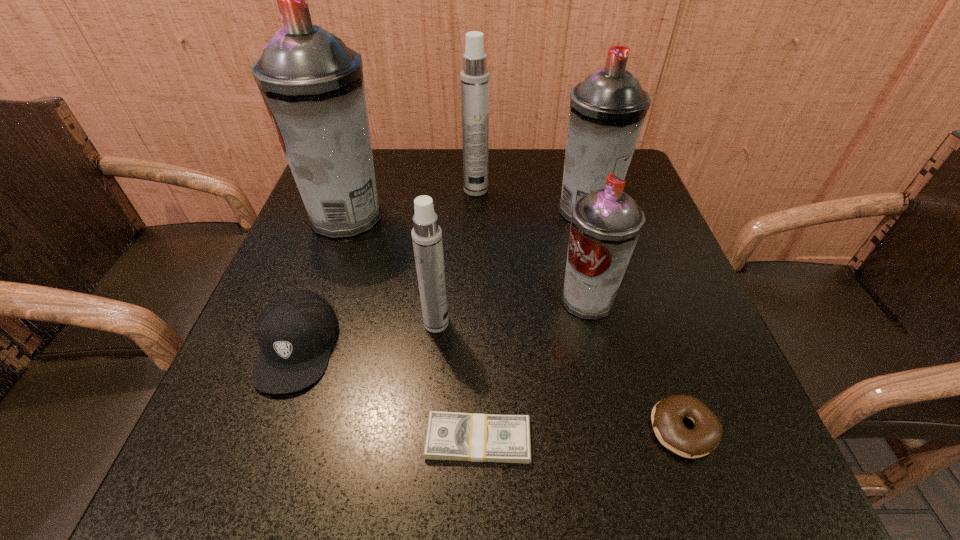
Find the location of a particular element. free spot between the seventh tallest object and the dollar is located at coordinates (581, 434).

I want to click on empty location between the tallest object and the right white aerosol can, so coord(412,203).

Find the location of a particular element. free space between the shortest object and the sixth tallest object is located at coordinates (388, 393).

Choose which object is the fifth nearest neighbor to the doughnut. Please provide its 2D coordinates. Your answer should be formatted as a tuple, i.e. [(x, y)], where the tuple contains the x and y coordinates of a point satisfying the conditions above.

[(295, 331)]

In order to click on object that is the seventh closest to the doughnut in this screenshot , I will do `click(312, 84)`.

Image resolution: width=960 pixels, height=540 pixels. In order to click on aerosol can that is the third closest to the nearest gray aerosol can in this screenshot , I will do `click(474, 77)`.

At what (x,y) coordinates should I click in order to perform the action: click on the fifth closest aerosol can to the doughnut. Please return your answer as a coordinate pair (x, y). This screenshot has height=540, width=960. Looking at the image, I should click on [x=312, y=84].

At what (x,y) coordinates should I click in order to perform the action: click on gray aerosol can that is the closest to the third shortest object. Please return your answer as a coordinate pair (x, y). Looking at the image, I should click on (312, 84).

The width and height of the screenshot is (960, 540). Find the location of `gray aerosol can object that ranks as the second closest to the smaller white aerosol can`. gray aerosol can object that ranks as the second closest to the smaller white aerosol can is located at coordinates (312, 84).

The image size is (960, 540). In order to click on free space that satisfies the following two spatial constraints: 1. on the front-facing side of the cap; 2. on the right side of the dollar in this screenshot , I will do `click(263, 440)`.